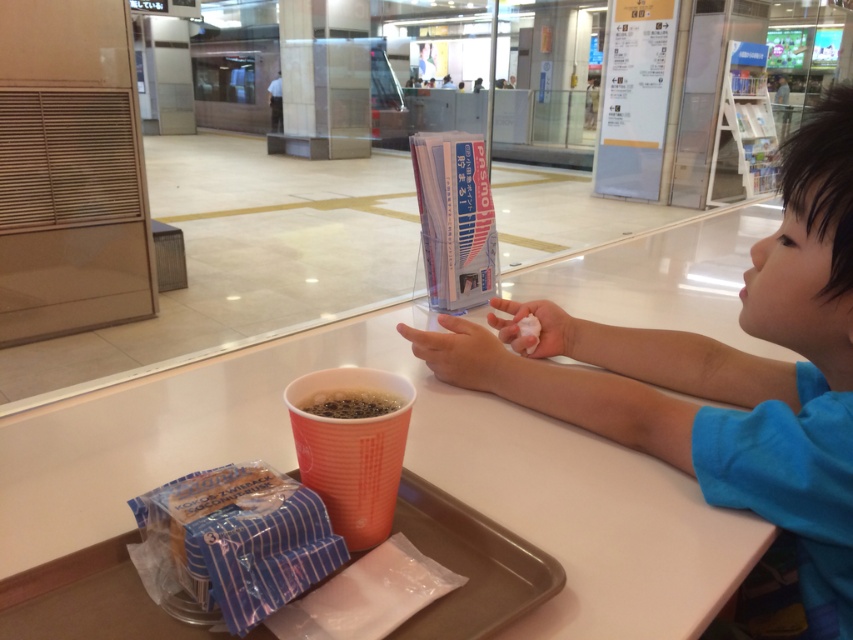
You are standing in a public space like a train station or mall. There is a point marked at coordinates (437,632). If you want to place a 50 cm ruler on the floor between yourself and that point, will it fit without overlapping?

The distance between you and the point is 51.00 centimeters. Since the ruler is 50 cm, it will fit without overlapping as there is 1 cm of extra space.

You are a parent looking for your child in a public space. You see the blue cotton shirt at right and the plastic tray at center. Which object is closer to the right edge of the image?

The blue cotton shirt at right is positioned on the right side of the plastic tray at center, so the blue cotton shirt at right is closer to the right edge of the image.